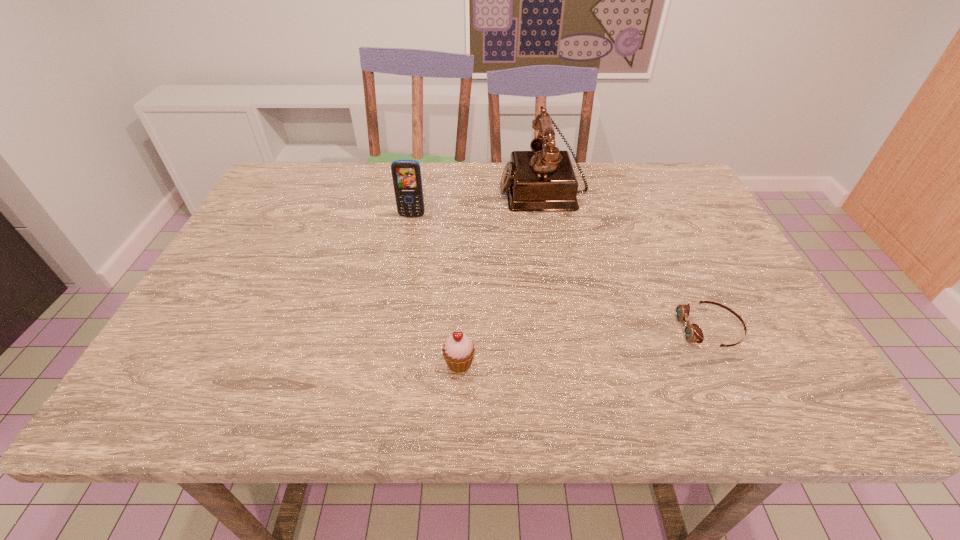
Find the location of `free location located on the dial of the tallest object`. free location located on the dial of the tallest object is located at coordinates (454, 188).

I want to click on vacant space located on the screen of the cellular telephone, so click(400, 276).

Where is `free spot located on the left of the second object from left to right`? This screenshot has height=540, width=960. free spot located on the left of the second object from left to right is located at coordinates (321, 363).

This screenshot has width=960, height=540. What are the coordinates of `vacant area situated 0.190m through the lenses of the goggles` in the screenshot? It's located at (586, 329).

Identify the location of vacant region located through the lenses of the goggles. (492, 329).

Identify the location of vacant region located through the lenses of the goggles. point(581,329).

At what (x,y) coordinates should I click in order to perform the action: click on object that is at the far edge. Please return your answer as a coordinate pair (x, y). Looking at the image, I should click on (543, 179).

You are a GUI agent. You are given a task and a screenshot of the screen. Output one action in this format:
    pyautogui.click(x=<x>, y=<y>)
    Task: Click on the object that is at the near edge
    This screenshot has height=540, width=960.
    Given the screenshot: What is the action you would take?
    pyautogui.click(x=458, y=351)

Find the location of `object present at the right edge`. object present at the right edge is located at coordinates (693, 333).

You are a GUI agent. You are given a task and a screenshot of the screen. Output one action in this format:
    pyautogui.click(x=<x>, y=<y>)
    Task: Click on the vacant space at the far edge
    Image resolution: width=960 pixels, height=540 pixels.
    Given the screenshot: What is the action you would take?
    pyautogui.click(x=332, y=187)